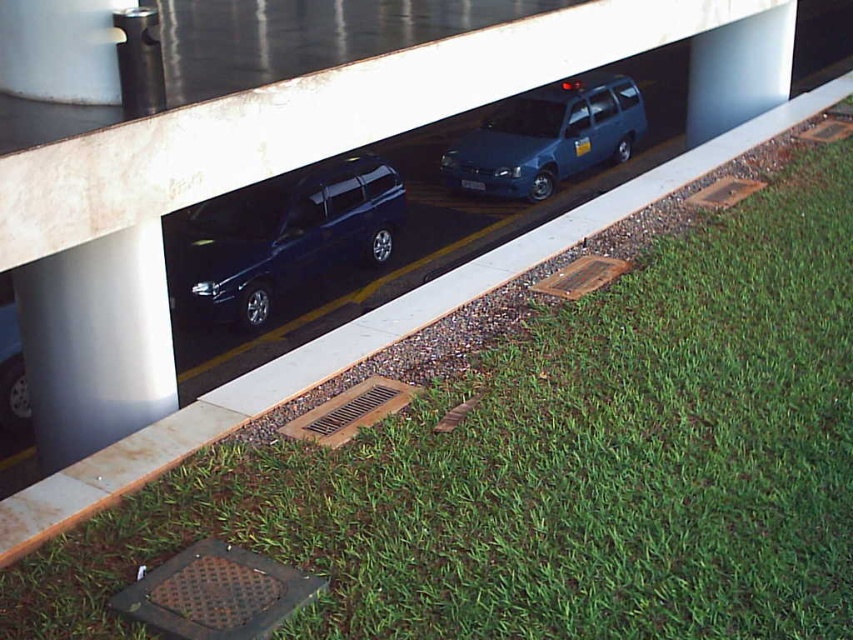
Between satin silver pillar at center left and smooth concrete pillar at upper center, which one is positioned higher?

smooth concrete pillar at upper center is higher up.

Is satin silver pillar at center left closer to camera compared to smooth concrete pillar at upper center?

Yes, it is in front of smooth concrete pillar at upper center.

Between point (45, 394) and point (752, 104), which one is positioned in front?

Point (45, 394)

Identify the location of satin silver pillar at center left. The image size is (853, 640). (96, 342).

Between point (486, 138) and point (752, 28), which one is positioned behind?

Point (486, 138)

Is point (625, 118) farther from viewer compared to point (764, 54)?

That is True.

I want to click on metallic blue minivan at center, so click(x=547, y=138).

Does glossy dark blue minivan at center come in front of smooth concrete pillar at upper center?

Yes.

Which is behind, point (254, 269) or point (751, 77)?

Point (751, 77)

This screenshot has width=853, height=640. Describe the element at coordinates (281, 237) in the screenshot. I see `glossy dark blue minivan at center` at that location.

Locate an element on the screen. Image resolution: width=853 pixels, height=640 pixels. glossy dark blue minivan at center is located at coordinates (281, 237).